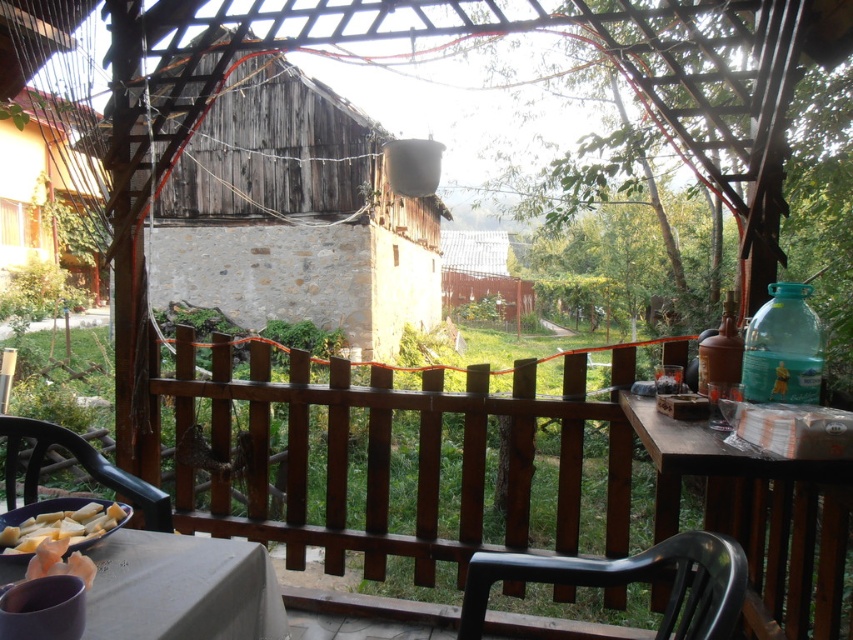
You are planning to place a new bench in the backyard that is 1.5 meters wide. You see the weathered wood hut at center and the black plastic chair at lower right. Which object can the bench fit next to without overlapping?

The bench can fit next to the weathered wood hut at center because its width is larger than the black plastic chair at lower right, providing more space.

You are standing on the patio and want to see the view beyond the brown wooden fence at center and the metallic corrugated roof at center. Which object would block your view more if you look straight ahead?

The brown wooden fence at center is in front of the metallic corrugated roof at center, so it would block your view more when looking straight ahead.

You are standing on the patio and want to place a new decorative item. You have two points marked on the image where you can place it. Which point, point (x=691, y=586) or point (x=442, y=236), is closer to you?

Point (x=691, y=586) is closer to the viewer than point (x=442, y=236), so you should place the item there if you want it nearer to your current position.